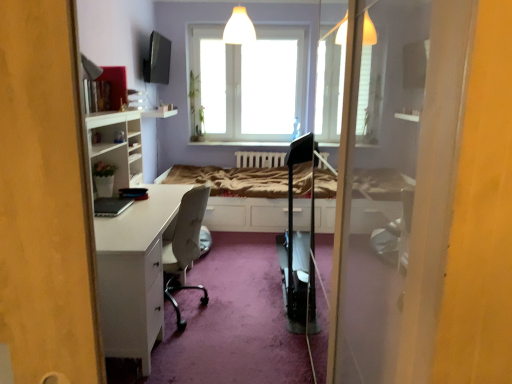
Question: From a real-world perspective, relative to transparent glass window at center, is white glossy desk at left vertically above or below?

Choices:
 (A) above
 (B) below

Answer: (B)

Question: Considering the positions of point (155, 210) and point (220, 96), is point (155, 210) closer or farther from the camera than point (220, 96)?

Choices:
 (A) closer
 (B) farther

Answer: (A)

Question: Which of these objects is positioned farthest from the transparent glass window at center?

Choices:
 (A) white glossy desk at left
 (B) white wooden bed frame at center

Answer: (A)

Question: Based on their relative distances, which object is farther from the white wooden bed frame at center?

Choices:
 (A) transparent glass window at center
 (B) white glossy desk at left

Answer: (B)